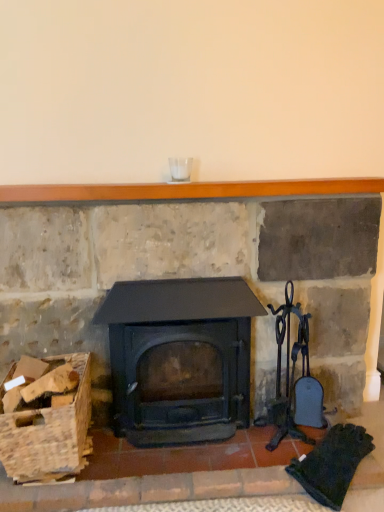
Question: Can you confirm if matte black wood burning stove at center is bigger than wooden crate at lower left?

Choices:
 (A) no
 (B) yes

Answer: (B)

Question: Is matte black wood burning stove at center at the right side of wooden crate at lower left?

Choices:
 (A) yes
 (B) no

Answer: (A)

Question: From a real-world perspective, is matte black wood burning stove at center beneath wooden crate at lower left?

Choices:
 (A) yes
 (B) no

Answer: (B)

Question: Is matte black wood burning stove at center facing towards wooden crate at lower left?

Choices:
 (A) no
 (B) yes

Answer: (A)

Question: Would you say matte black wood burning stove at center is outside wooden crate at lower left?

Choices:
 (A) yes
 (B) no

Answer: (A)

Question: From a real-world perspective, is wooden mantlepiece at upper center positioned above or below wooden crate at lower left?

Choices:
 (A) above
 (B) below

Answer: (A)

Question: From the image's perspective, is wooden mantlepiece at upper center above or below wooden crate at lower left?

Choices:
 (A) below
 (B) above

Answer: (B)

Question: Is point (269, 183) positioned closer to the camera than point (16, 436)?

Choices:
 (A) farther
 (B) closer

Answer: (A)

Question: In terms of height, does wooden mantlepiece at upper center look taller or shorter compared to wooden crate at lower left?

Choices:
 (A) short
 (B) tall

Answer: (A)

Question: From the image's perspective, is matte black wood burning stove at center positioned above or below wooden crate at lower left?

Choices:
 (A) above
 (B) below

Answer: (A)

Question: Is point (155, 424) closer or farther from the camera than point (23, 419)?

Choices:
 (A) farther
 (B) closer

Answer: (A)

Question: Considering the positions of matte black wood burning stove at center and wooden crate at lower left in the image, is matte black wood burning stove at center taller or shorter than wooden crate at lower left?

Choices:
 (A) short
 (B) tall

Answer: (B)

Question: Based on their positions, is matte black wood burning stove at center located to the left or right of wooden crate at lower left?

Choices:
 (A) left
 (B) right

Answer: (B)

Question: From a real-world perspective, is wooden crate at lower left physically located above or below matte black wood burning stove at center?

Choices:
 (A) below
 (B) above

Answer: (A)

Question: Looking at the image, does wooden crate at lower left seem bigger or smaller compared to matte black wood burning stove at center?

Choices:
 (A) small
 (B) big

Answer: (A)